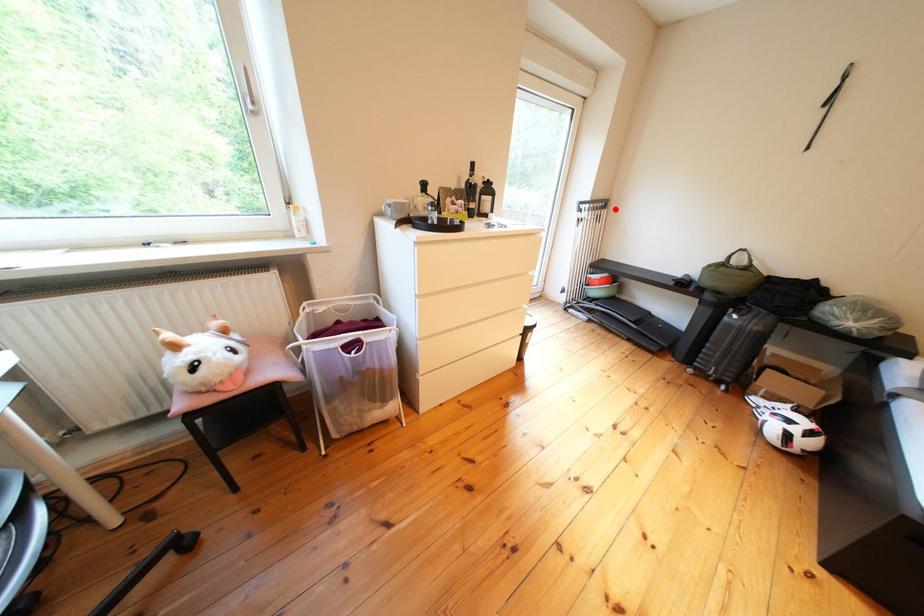
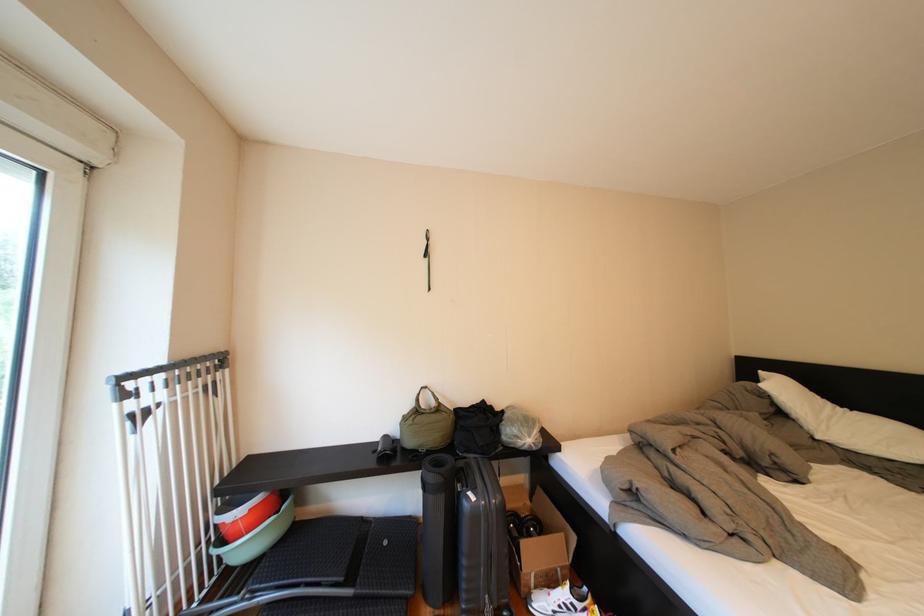
Find the pixel in the second image that matches the highlighted location in the first image.

(224, 369)